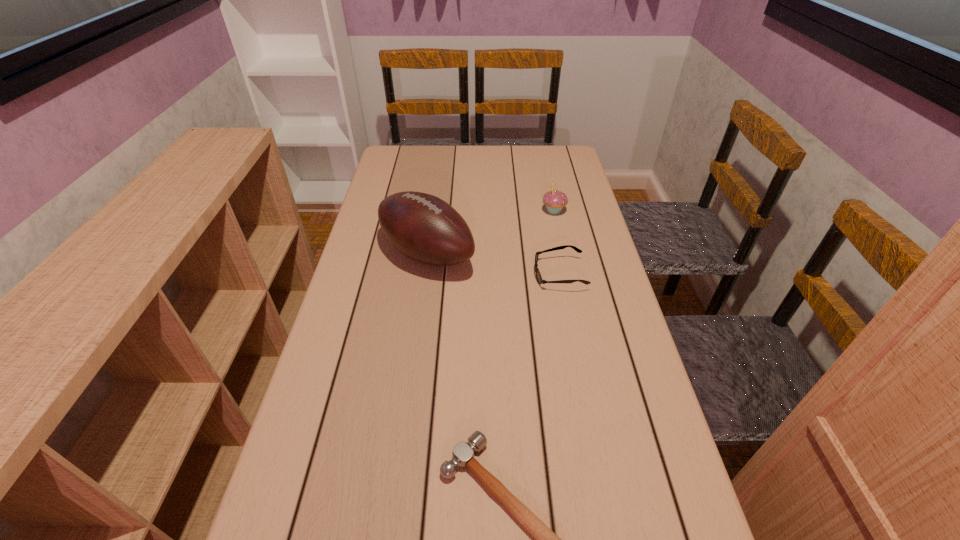
Locate an element on the screen. This screenshot has width=960, height=540. cupcake that is at the right edge is located at coordinates (554, 200).

In order to click on sunglasses that is at the right edge in this screenshot , I will do pyautogui.click(x=538, y=276).

In order to click on blank space at the far edge of the desktop in this screenshot , I will do `click(523, 171)`.

What are the coordinates of `vacant area at the left edge` in the screenshot? It's located at (378, 268).

The image size is (960, 540). What are the coordinates of `free space at the right edge of the desktop` in the screenshot? It's located at (577, 312).

The image size is (960, 540). Find the location of `vacant space at the far right corner of the desktop`. vacant space at the far right corner of the desktop is located at coordinates coord(540,173).

Locate an element on the screen. The width and height of the screenshot is (960, 540). vacant area that lies between the tallest object and the sunglasses is located at coordinates (493, 264).

Find the location of `unoccupied area between the tallest object and the third shortest object`. unoccupied area between the tallest object and the third shortest object is located at coordinates (491, 232).

Identify the location of free space between the football (American) and the second shortest object. (493, 264).

Where is `vacant region between the tallest object and the sunglasses`? The image size is (960, 540). vacant region between the tallest object and the sunglasses is located at coordinates (493, 264).